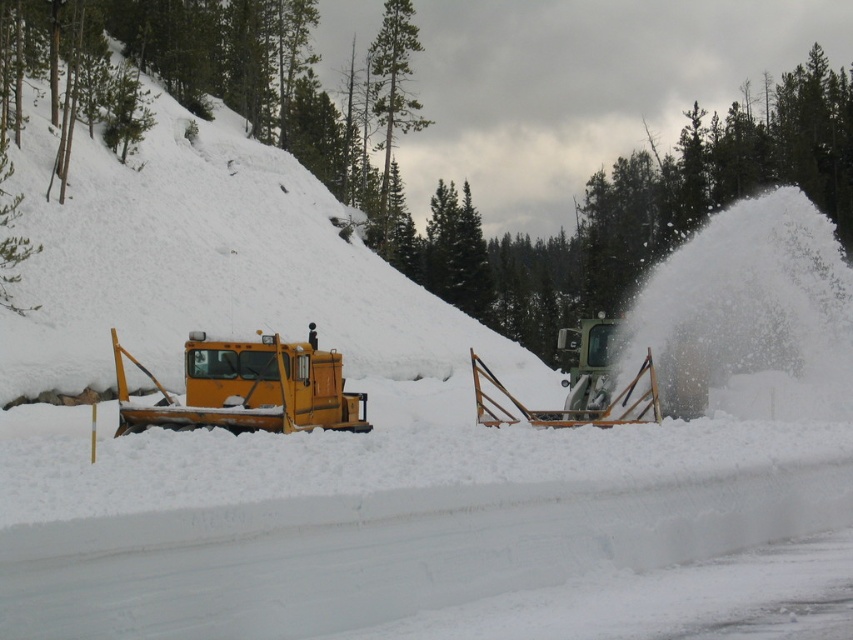
Based on the photo, who is more forward, (90, 340) or (485, 376)?

Positioned in front is point (485, 376).

Is point (253, 216) behind point (538, 417)?

Yes, it is.

Where is `white snow at upper left`? The width and height of the screenshot is (853, 640). white snow at upper left is located at coordinates (213, 266).

Which is behind, point (245, 346) or point (595, 348)?

The point (595, 348) is behind.

Is yellow matte/snowplow at left below metallic silver plow at center?

Incorrect, yellow matte/snowplow at left is not positioned below metallic silver plow at center.

The width and height of the screenshot is (853, 640). In order to click on yellow matte/snowplow at left in this screenshot , I will do `click(248, 388)`.

Which of these two, white snow at upper left or yellow matte/snowplow at left, stands shorter?

yellow matte/snowplow at left is shorter.

Is white snow at upper left smaller than yellow matte/snowplow at left?

Incorrect, white snow at upper left is not smaller in size than yellow matte/snowplow at left.

This screenshot has width=853, height=640. What do you see at coordinates (213, 266) in the screenshot? I see `white snow at upper left` at bounding box center [213, 266].

Locate an element on the screen. This screenshot has width=853, height=640. white snow at upper left is located at coordinates (213, 266).